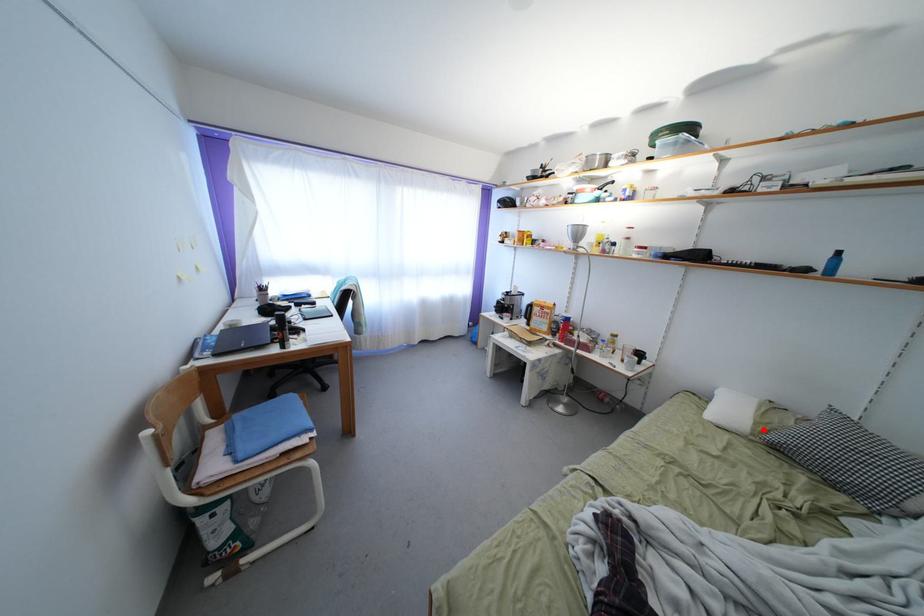
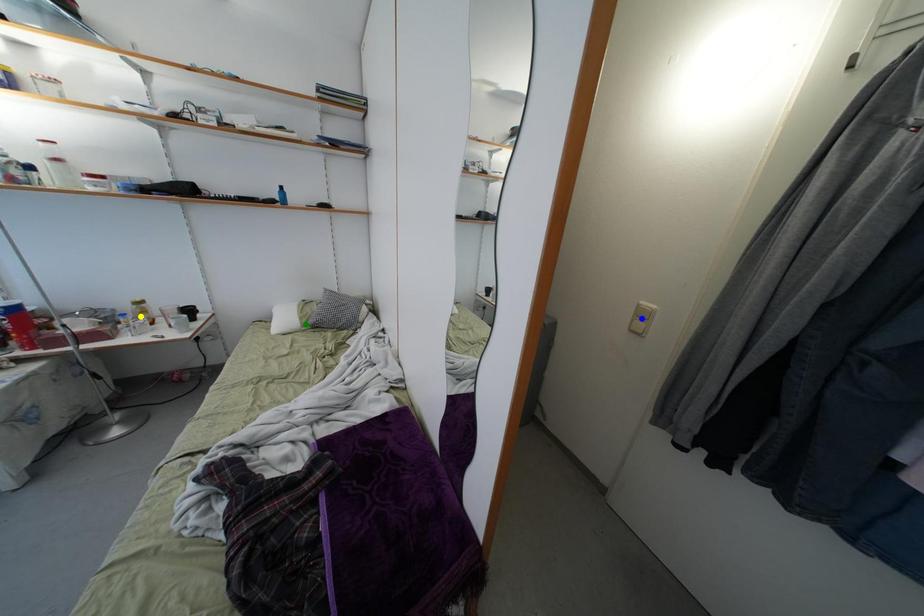
Question: I am providing you with two images of the same scene from different viewpoints. A red point is marked on the first image. You are given multiple points on the second image. In image 2, which mark is for the same physical point as the one in image 1?

Choices:
 (A) yellow point
 (B) blue point
 (C) green point

Answer: (C)